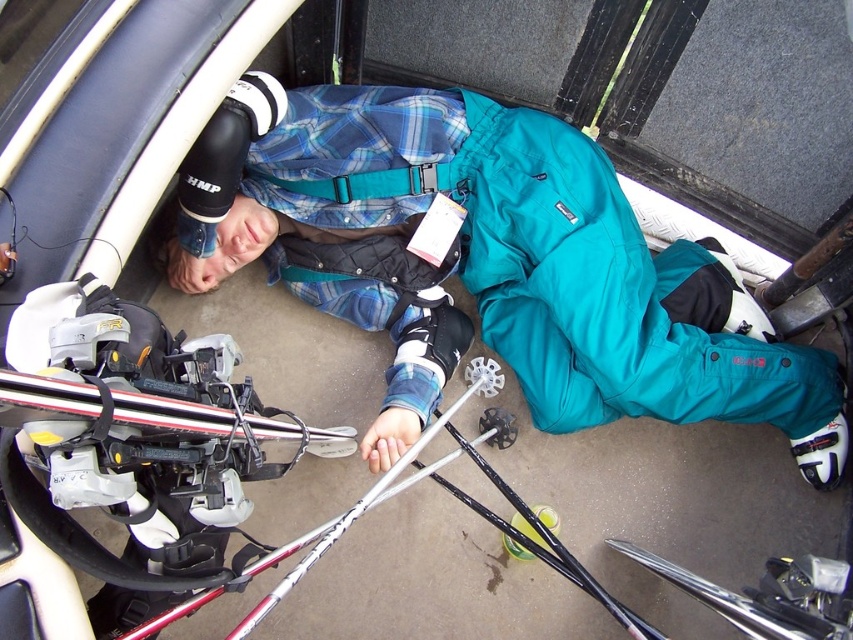
Question: Can you confirm if teal waterproof suit at center is smaller than teal fabric strap at center?

Choices:
 (A) no
 (B) yes

Answer: (A)

Question: Observing the image, what is the correct spatial positioning of teal waterproof suit at center in reference to teal fabric strap at center?

Choices:
 (A) below
 (B) above

Answer: (A)

Question: Where is teal waterproof suit at center located in relation to teal fabric strap at center in the image?

Choices:
 (A) right
 (B) left

Answer: (A)